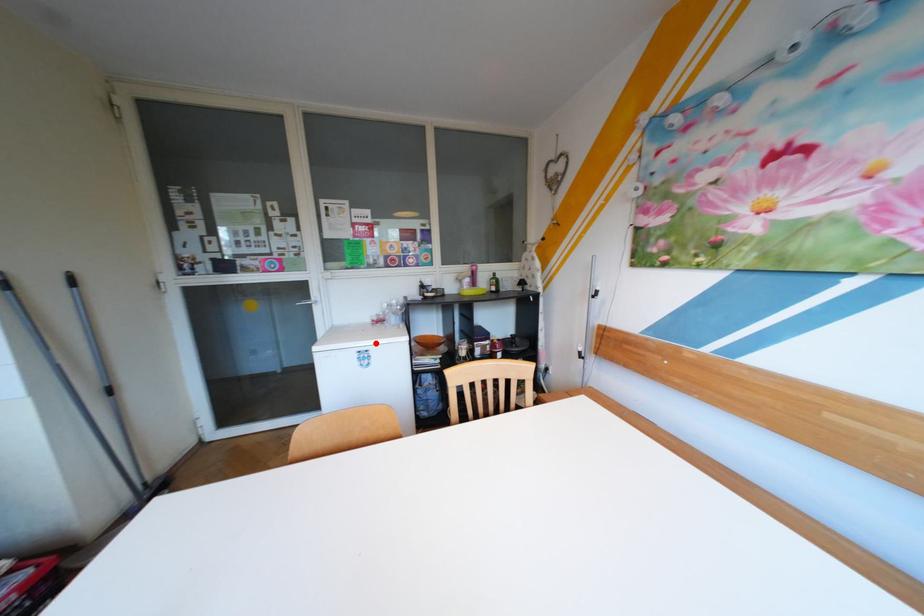
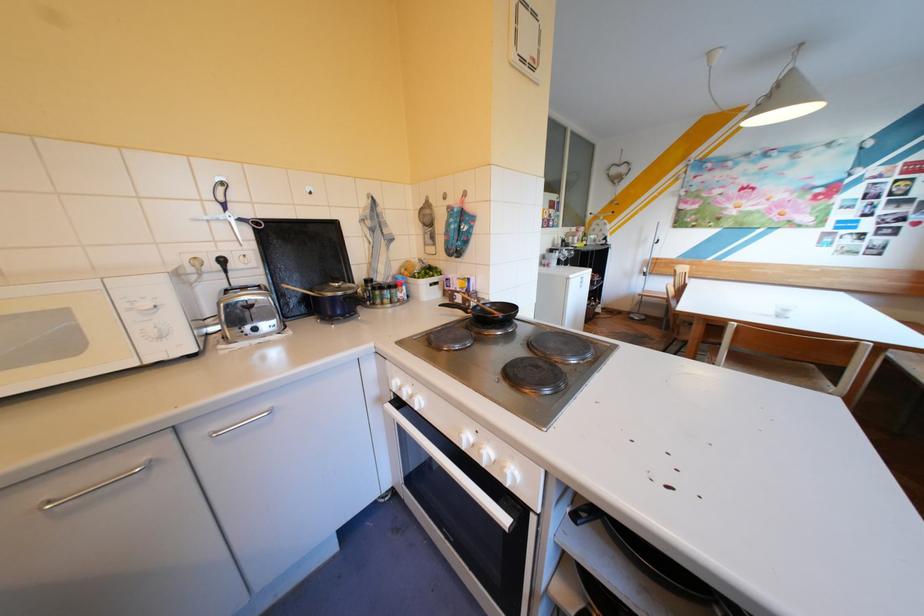
Question: I am providing you with two images of the same scene from different viewpoints. A red point is marked on the first image. At the location where the point appears in image 1, is it still visible in image 2?

Choices:
 (A) Yes
 (B) No

Answer: (B)